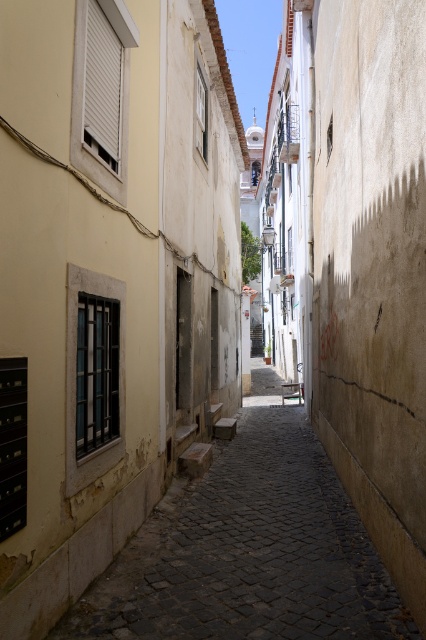
Which is behind, point (397, 532) or point (144, 541)?

Point (144, 541)

Between smooth beige wall at right and smooth stone alley at center, which one is positioned lower?

smooth stone alley at center is below.

Between point (324, 225) and point (385, 570), which one is positioned in front?

Positioned in front is point (385, 570).

Identify the location of smooth beige wall at right. (371, 268).